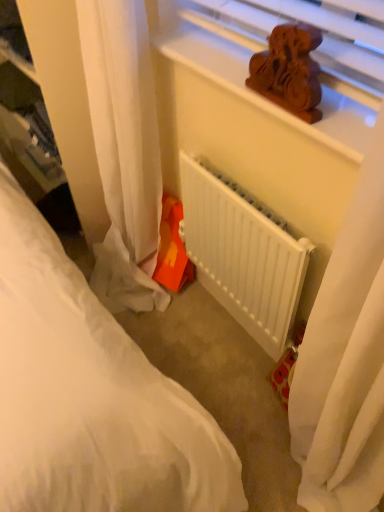
Where is `vacant space in front of orange plastic toy at lower center`? vacant space in front of orange plastic toy at lower center is located at coordinates (169, 315).